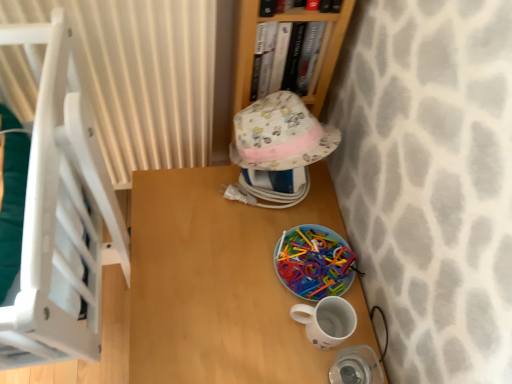
Locate an element on the screen. This screenshot has height=384, width=512. vacant space positioned to the left of white glossy mug at lower right is located at coordinates (240, 306).